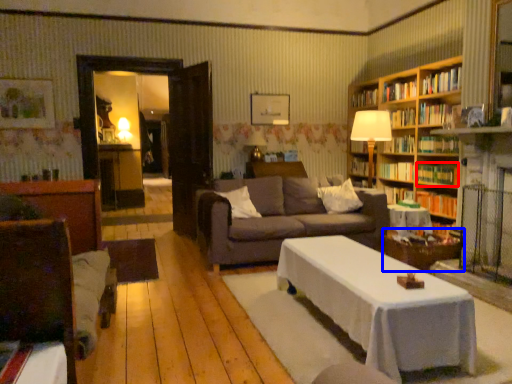
Question: Which point is closer to the camera, book (highlighted by a red box) or side table (highlighted by a blue box)?

Choices:
 (A) book
 (B) side table

Answer: (B)